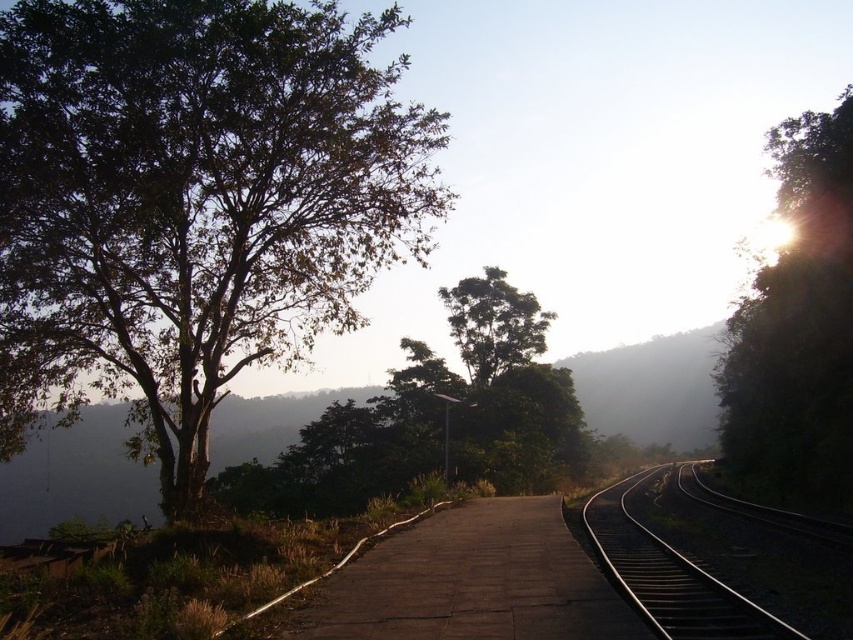
Question: Among these objects, which one is nearest to the camera?

Choices:
 (A) green leafy tree at left
 (B) metallic silver train track at center
 (C) dark brown concrete path at center

Answer: (C)

Question: Is green leafy tree at upper right to the left of dark brown concrete path at center from the viewer's perspective?

Choices:
 (A) yes
 (B) no

Answer: (B)

Question: Which point is closer to the camera?

Choices:
 (A) (467, 353)
 (B) (422, 576)
 (C) (44, 284)
 (D) (845, 492)

Answer: (B)

Question: Is green leafy tree at upper right further to the viewer compared to green leafy tree at center?

Choices:
 (A) no
 (B) yes

Answer: (A)

Question: Is dark brown concrete path at center thinner than green leafy tree at center?

Choices:
 (A) no
 (B) yes

Answer: (B)

Question: Which object appears farthest from the camera in this image?

Choices:
 (A) dark brown concrete path at center
 (B) green leafy tree at upper right

Answer: (B)